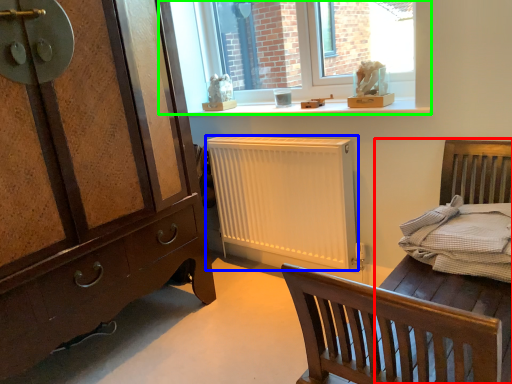
Question: Based on their relative distances, which object is nearer to bed frame (highlighted by a red box)? Choose from radiator (highlighted by a blue box) and window (highlighted by a green box).

Choices:
 (A) radiator
 (B) window

Answer: (A)